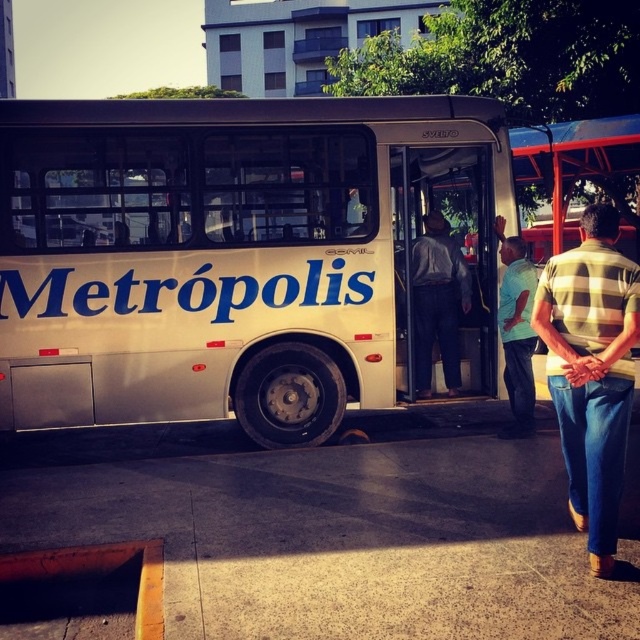
Consider the image. Who is higher up, white metallic bus at center or dark gray pants at center?

white metallic bus at center is above.

Is white metallic bus at center taller than dark gray pants at center?

Correct, white metallic bus at center is much taller as dark gray pants at center.

Which is behind, point (179, 129) or point (419, 371)?

Point (419, 371)

Where is `white metallic bus at center`? Image resolution: width=640 pixels, height=640 pixels. white metallic bus at center is located at coordinates (232, 256).

Is dark gray pants at center positioned in front of light blue shirt at center?

No, dark gray pants at center is further to the viewer.

Is dark gray pants at center further to camera compared to light blue shirt at center?

Yes, dark gray pants at center is behind light blue shirt at center.

Who is more forward, (465, 307) or (522, 326)?

Point (522, 326) is more forward.

Image resolution: width=640 pixels, height=640 pixels. What are the coordinates of `dark gray pants at center` in the screenshot? It's located at (436, 301).

You are a GUI agent. You are given a task and a screenshot of the screen. Output one action in this format:
    pyautogui.click(x=<x>, y=<y>)
    Task: Click on the white metallic bus at center
    The height and width of the screenshot is (640, 640).
    Given the screenshot: What is the action you would take?
    pyautogui.click(x=232, y=256)

Who is more distant from viewer, (420, 108) or (596, 340)?

Positioned behind is point (420, 108).

Identify the location of white metallic bus at center. (232, 256).